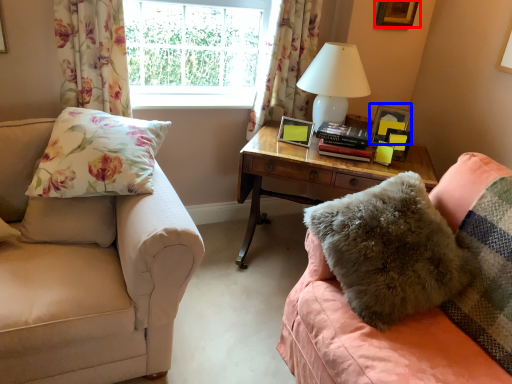
Question: Among these objects, which one is nearest to the camera, picture frame (highlighted by a red box) or picture frame (highlighted by a blue box)?

Choices:
 (A) picture frame
 (B) picture frame

Answer: (B)